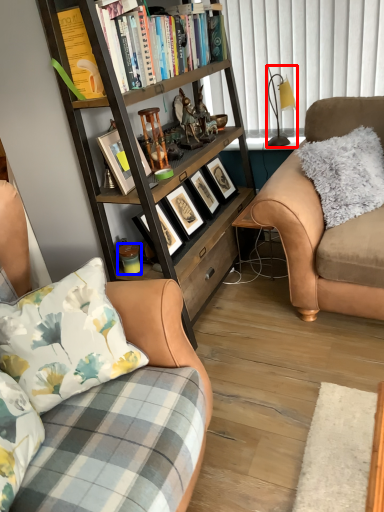
Question: Which object appears closest to the camera in this image, lamp (highlighted by a red box) or coffee cup (highlighted by a blue box)?

Choices:
 (A) lamp
 (B) coffee cup

Answer: (B)